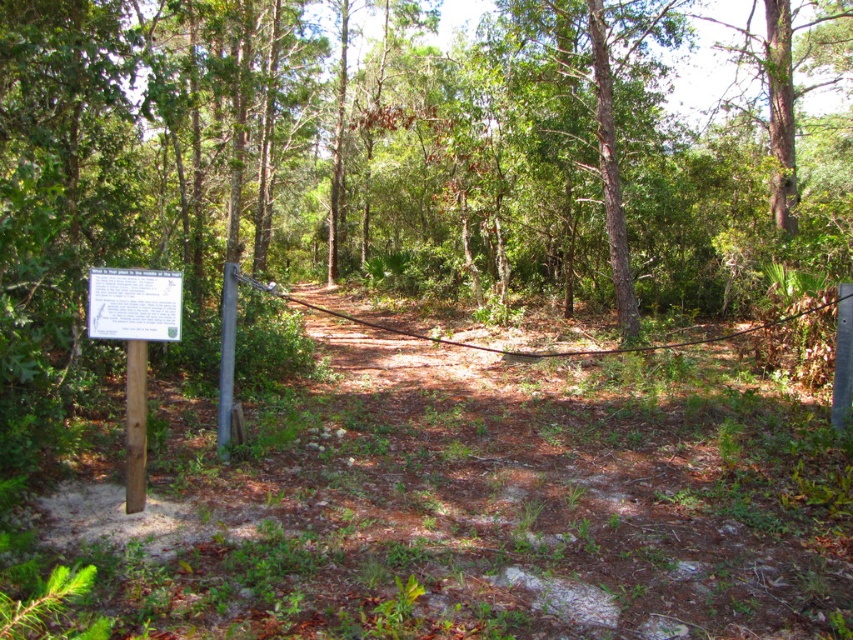
Question: Does brown dirt track at center have a smaller size compared to white paper sign at left?

Choices:
 (A) no
 (B) yes

Answer: (B)

Question: Which object appears farthest from the camera in this image?

Choices:
 (A) white paper sign at left
 (B) brown dirt track at center

Answer: (A)

Question: Considering the relative positions of brown dirt track at center and white paper sign at left in the image provided, where is brown dirt track at center located with respect to white paper sign at left?

Choices:
 (A) left
 (B) right

Answer: (B)

Question: Which of the following is the closest to the observer?

Choices:
 (A) (321, 604)
 (B) (103, 282)

Answer: (A)

Question: Among these points, which one is nearest to the camera?

Choices:
 (A) (554, 536)
 (B) (88, 294)

Answer: (B)

Question: Can you confirm if brown dirt track at center is thinner than white paper sign at left?

Choices:
 (A) yes
 (B) no

Answer: (A)